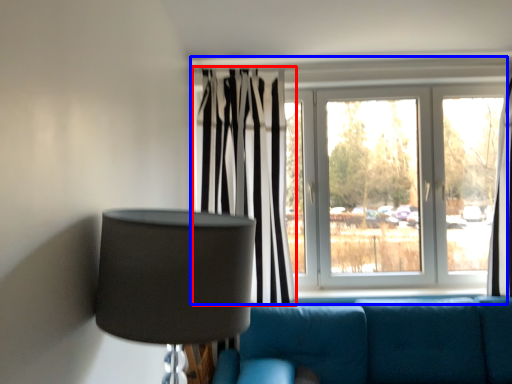
Question: Among these objects, which one is nearest to the camera, curtain (highlighted by a red box) or window (highlighted by a blue box)?

Choices:
 (A) curtain
 (B) window

Answer: (A)